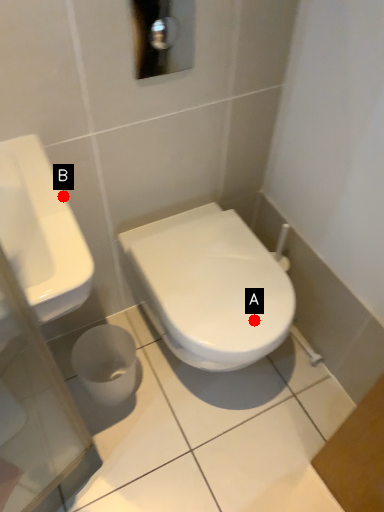
Question: Two points are circled on the image, labeled by A and B beside each circle. Which point is closer to the camera taking this photo?

Choices:
 (A) A is closer
 (B) B is closer

Answer: (B)